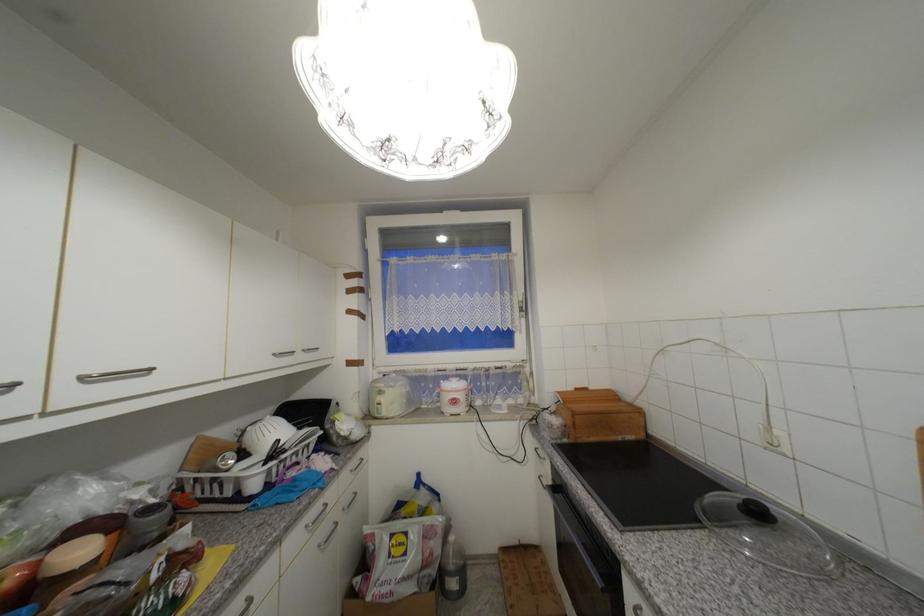
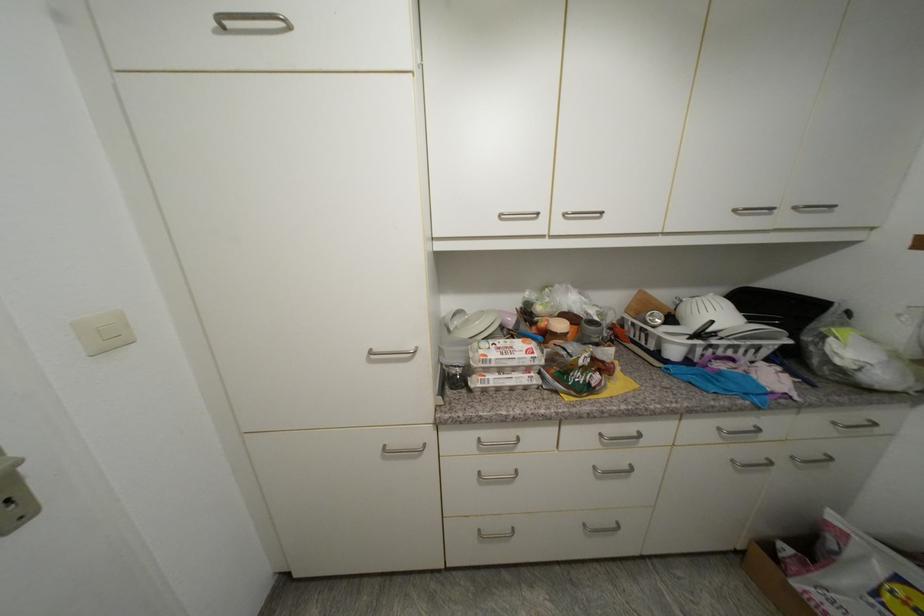
Locate, in the second image, the point that corresponds to point (154, 512) in the first image.

(598, 323)